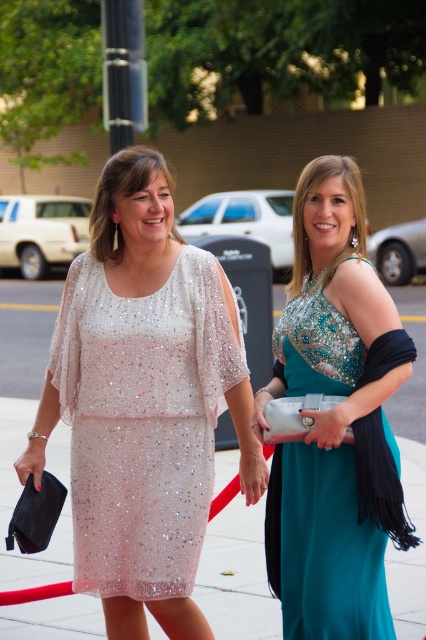
You are a photographer trying to capture the sequined fabric dress at left. Given that the camera frame is centered at point 0.5, 0.5, will the dress be in the center of the frame?

The sequined fabric dress at left is located at point [143,420], which is to the right and slightly above the center point of the frame. Therefore, it will not be centered in the camera frame.

You are a photographer at a fashion show. You need to position the sequined fabric dress at left and the pearl sequined dress at center so that both are visible in the frame. Based on their current positions, which dress is lower in the image?

The sequined fabric dress at left is below the pearl sequined dress at center, so the sequined fabric dress at left is lower in the image.